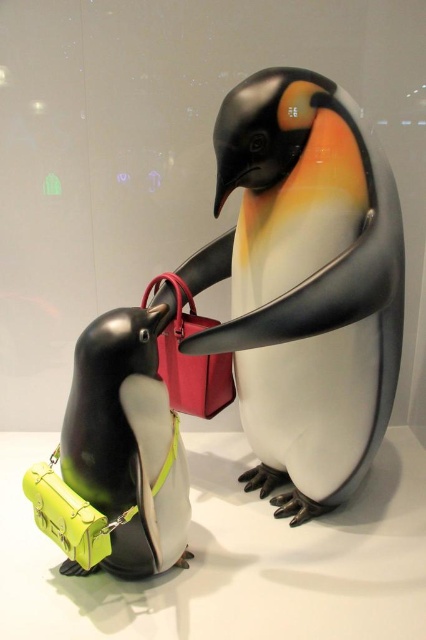
You are an interior designer arranging items on a shelf. You have a glossy plastic penguin at center and a matte green leather bag at lower left. Given their sizes, which item will occupy more horizontal space on the shelf?

The glossy plastic penguin at center will occupy more horizontal space on the shelf because its width surpasses that of the matte green leather bag at lower left.

You are an interior designer arranging a shelf for a client who wants to display both the glossy plastic penguin at center and the matte green leather bag at lower left. The client prefers the larger item to be placed at the back for stability. Based on the image, which item should you place at the back?

The glossy plastic penguin at center is bigger than the matte green leather bag at lower left, so you should place the glossy plastic penguin at center at the back for stability.